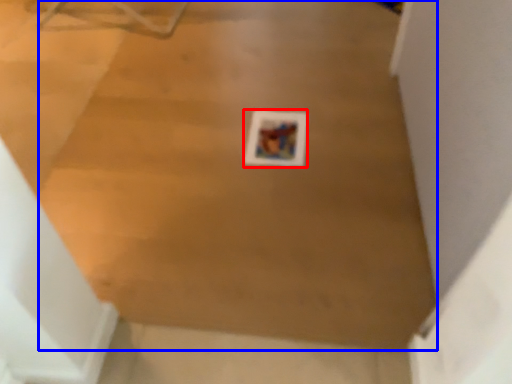
Question: Which point is further to the camera, print (highlighted by a red box) or plywood (highlighted by a blue box)?

Choices:
 (A) print
 (B) plywood

Answer: (A)